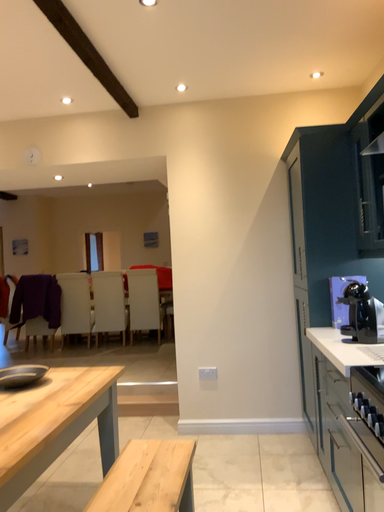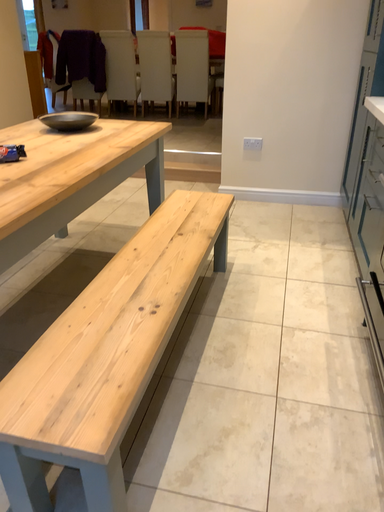
Question: How did the camera likely rotate when shooting the video?

Choices:
 (A) rotated downward
 (B) rotated upward

Answer: (A)